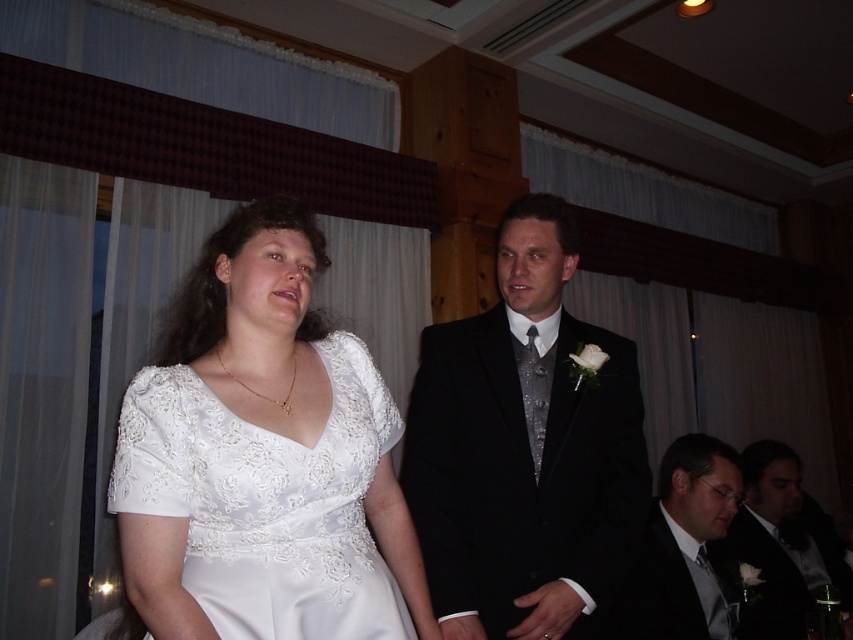
You are a photographer standing at the camera position. You need to capture a closeup shot of the white satin dress at center. The camera can focus on objects within 1 meter. Will you be able to take the photo without moving closer?

The white satin dress at center is 1.13 meters away from camera. Since the camera can focus on objects within 1 meter, you will need to move closer to ensure proper focus.

Based on the coordinates provided, which object is located at point [258,435] in the image?

The point [258,435] corresponds to the white satin dress at center.